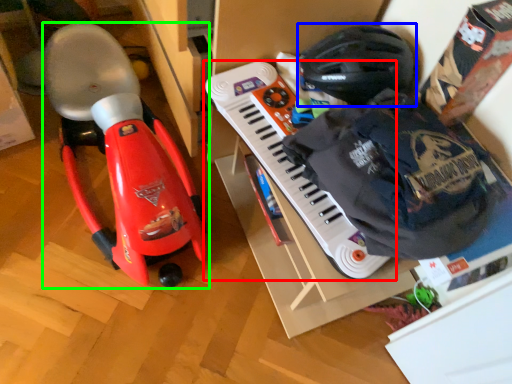
Question: Which object is positioned farthest from musical keyboard (highlighted by a red box)? Select from helmet (highlighted by a blue box) and toy (highlighted by a green box).

Choices:
 (A) helmet
 (B) toy

Answer: (B)